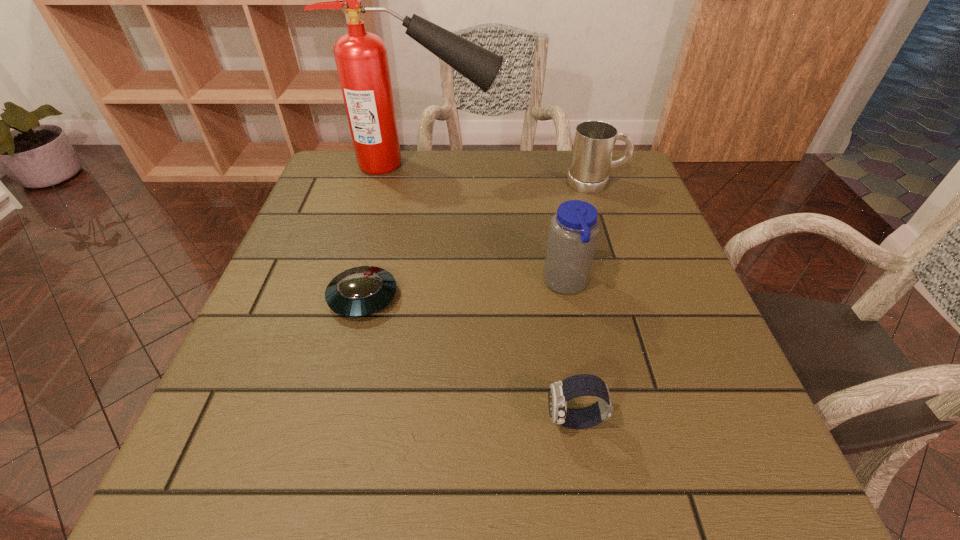
This screenshot has height=540, width=960. I want to click on unoccupied position between the second tallest object and the saucer, so click(465, 291).

The image size is (960, 540). I want to click on vacant space that's between the third tallest object and the fourth tallest object, so click(586, 301).

Identify the location of vacant space that is in between the fire extinguisher and the water bottle. The image size is (960, 540). (493, 224).

Find the location of a particular element. The width and height of the screenshot is (960, 540). empty location between the saucer and the fire extinguisher is located at coordinates (392, 231).

This screenshot has width=960, height=540. Find the location of `free spot between the nearest object and the shortest object`. free spot between the nearest object and the shortest object is located at coordinates (469, 359).

This screenshot has height=540, width=960. What are the coordinates of `vacant area between the third shortest object and the fire extinguisher` in the screenshot? It's located at (508, 173).

Find the location of `vacant area between the watch and the shortest object`. vacant area between the watch and the shortest object is located at coordinates (469, 359).

You are a GUI agent. You are given a task and a screenshot of the screen. Output one action in this format:
    pyautogui.click(x=<x>, y=<y>)
    Task: Click on the unoccupied position between the rightmost object and the watch
    This screenshot has width=960, height=540.
    Given the screenshot: What is the action you would take?
    pyautogui.click(x=586, y=301)

Identify which object is the closest to the fire extinguisher. Please provide its 2D coordinates. Your answer should be formatted as a tuple, i.e. [(x, y)], where the tuple contains the x and y coordinates of a point satisfying the conditions above.

[(594, 141)]

You are a GUI agent. You are given a task and a screenshot of the screen. Output one action in this format:
    pyautogui.click(x=<x>, y=<y>)
    Task: Click on the object that is the closest to the tallest object
    This screenshot has height=540, width=960.
    Given the screenshot: What is the action you would take?
    pyautogui.click(x=594, y=141)